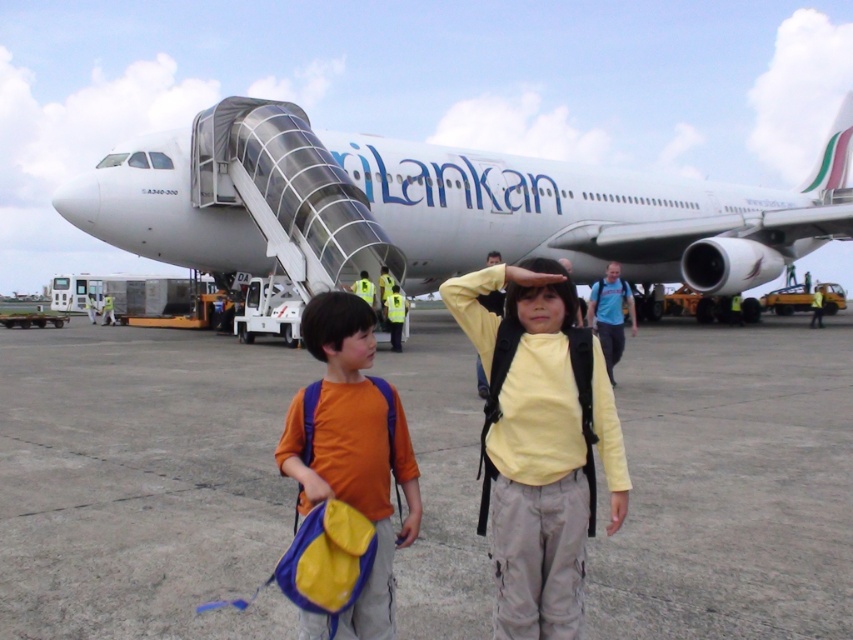
Question: Does gray concrete tarmac at center have a larger size compared to white glossy airplane at center?

Choices:
 (A) no
 (B) yes

Answer: (A)

Question: Can you confirm if gray concrete tarmac at center is smaller than orange fabric backpack at center?

Choices:
 (A) yes
 (B) no

Answer: (B)

Question: Which object is the farthest from the orange fabric backpack at center?

Choices:
 (A) gray concrete tarmac at center
 (B) white glossy airplane at center

Answer: (B)

Question: Which object is positioned closest to the orange fabric backpack at center?

Choices:
 (A) gray concrete tarmac at center
 (B) yellow matte shirt at center

Answer: (B)

Question: Which point appears farthest from the camera in this image?

Choices:
 (A) (780, 500)
 (B) (554, 266)

Answer: (A)

Question: Is white glossy airplane at center to the right of yellow matte shirt at center from the viewer's perspective?

Choices:
 (A) yes
 (B) no

Answer: (A)